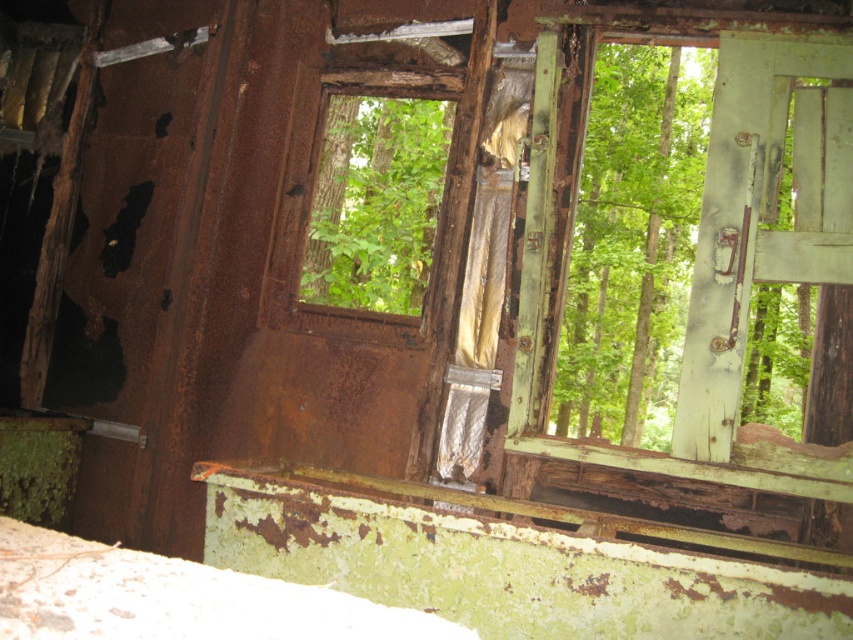
Who is lower down, rusty wood window at center or green leafy tree at center?

A: rusty wood window at center

At what (x,y) coordinates should I click in order to perform the action: click on rusty wood window at center. Please return your answer as a coordinate pair (x, y). The height and width of the screenshot is (640, 853). Looking at the image, I should click on (374, 180).

I want to click on rusty wood window at center, so click(x=374, y=180).